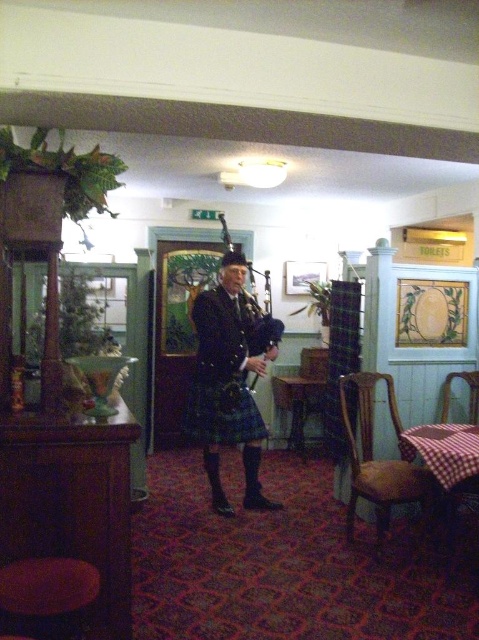
Does matte black kilt at center appear on the left side of woven fabric chair at lower right?

Correct, you'll find matte black kilt at center to the left of woven fabric chair at lower right.

Looking at this image, is matte black kilt at center shorter than woven fabric chair at lower right?

Incorrect, matte black kilt at center's height does not fall short of woven fabric chair at lower right's.

Between point (213, 417) and point (469, 419), which one is positioned in front?

Point (213, 417) is more forward.

The width and height of the screenshot is (479, 640). Find the location of `matte black kilt at center`. matte black kilt at center is located at coordinates (229, 380).

Does woven fabric chair at lower right appear under matte black bagpipes at center?

Indeed, woven fabric chair at lower right is positioned under matte black bagpipes at center.

Does woven fabric chair at lower right have a smaller size compared to matte black bagpipes at center?

Yes, woven fabric chair at lower right is smaller than matte black bagpipes at center.

At what (x,y) coordinates should I click in order to perform the action: click on woven fabric chair at lower right. Please return your answer as a coordinate pair (x, y). Looking at the image, I should click on [x=468, y=394].

Find the location of a particular element. dark brown wooden stool at lower left is located at coordinates (48, 595).

Is point (64, 563) closer to camera compared to point (269, 301)?

That is True.

Image resolution: width=479 pixels, height=640 pixels. What are the coordinates of `dark brown wooden stool at lower left` in the screenshot? It's located at (48, 595).